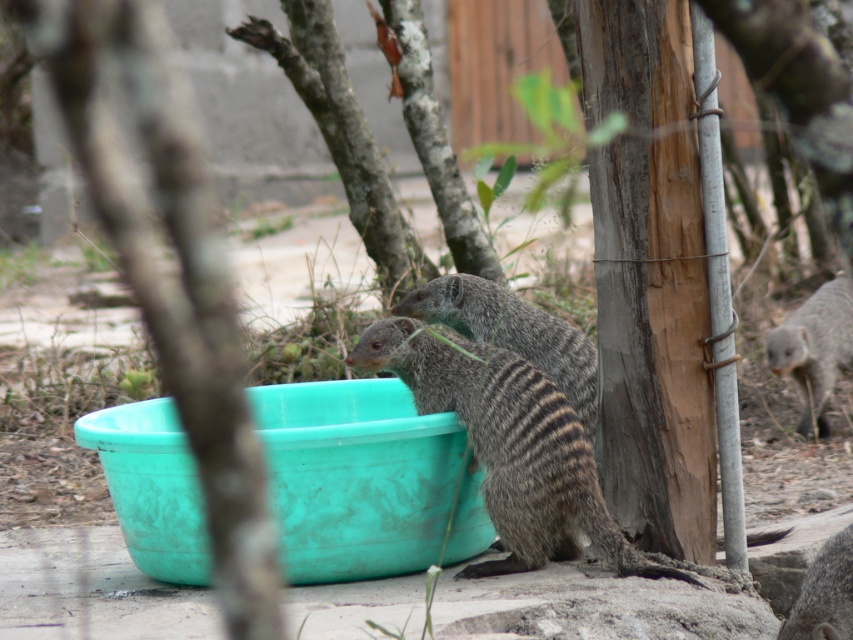
You are a photographer trying to capture a closeup of the two points in the image. Which point, point (816, 300) or point (828, 636), is closer to your camera lens?

Point (816, 300) is closer to the camera lens because it is further to the viewer than point (828, 636).